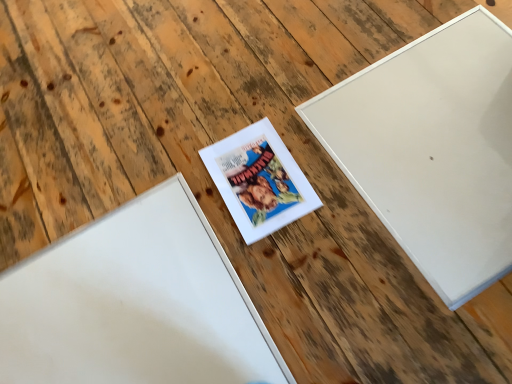
At what (x,y) coordinates should I click in order to perform the action: click on vacant space that's between white matte picture frame at center, which is the second picture frame from left to right, and white matte picture frame at center, positioned as the first picture frame in left-to-right order. Please return your answer as a coordinate pair (x, y). This screenshot has height=384, width=512. Looking at the image, I should click on (242, 246).